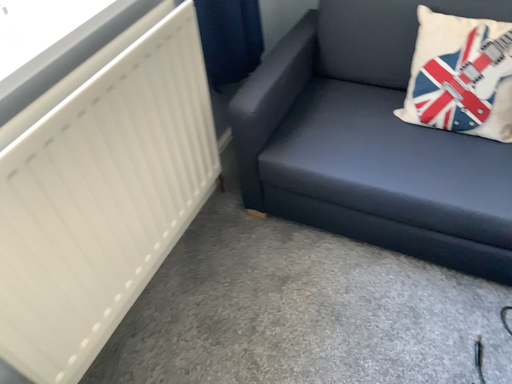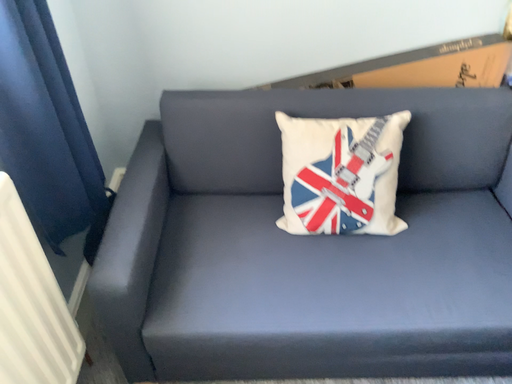
Question: How did the camera likely rotate when shooting the video?

Choices:
 (A) rotated right
 (B) rotated left

Answer: (A)